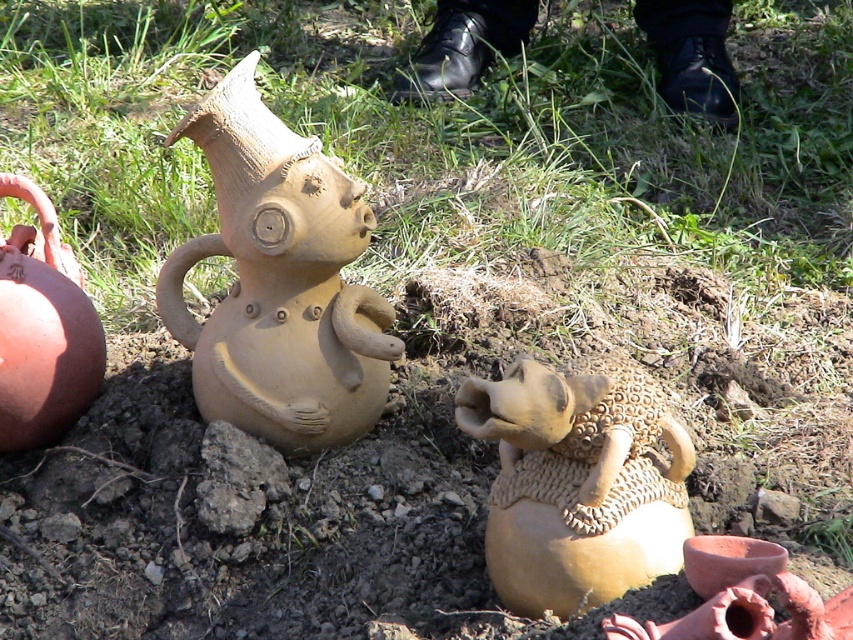
You are standing in front of the ceramic pottery display. There are two points marked on the ground, point 1 at coordinates (219, 196) and point 2 at coordinates (41, 275). If you want to walk from point 1 to point 2, which direction should you move relative to your current position?

You should move backward because point 1 at coordinates (219, 196) is in front of point 2 at coordinates (41, 275), meaning point 2 is behind you relative to your current position at point 1.

You are a delivery person who needs to place a new ceramic piece at coordinate point 0.756, 0.678. Where should you place it in relation to the matte clay pig at center?

The matte clay pig at center is already positioned at coordinate point (577, 483), so you should place the new ceramic piece at the same location as the matte clay pig at center.

You are an artist who wants to place a new sculpture between the two matte clay objects at the left side of the scene. The sculpture is 15 cm wide. Can the space between the matte clay figure at left and the matte clay jug at left accommodate this sculpture?

The matte clay figure at left is larger in size than the matte clay jug at left, but without specific measurements of the distance between them, it is impossible to determine if the 15 cm wide sculpture will fit.